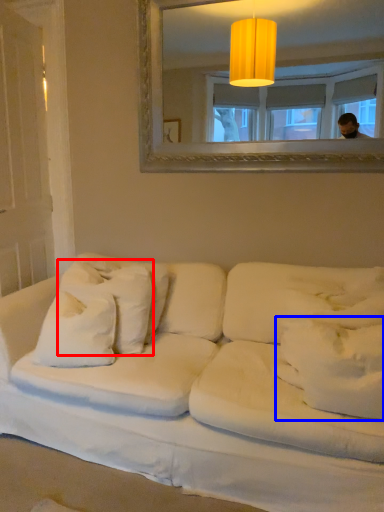
Question: Which of the following is the closest to the observer, pillow (highlighted by a red box) or pillow (highlighted by a blue box)?

Choices:
 (A) pillow
 (B) pillow

Answer: (B)